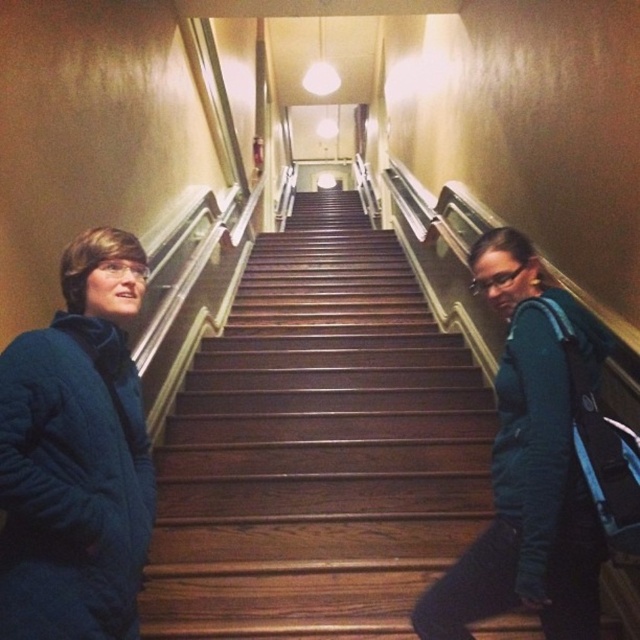
Question: Which point appears closest to the camera in this image?

Choices:
 (A) (339, 324)
 (B) (122, 474)
 (C) (532, 531)

Answer: (C)

Question: Which object is the farthest from the blue puffy jacket at left?

Choices:
 (A) brown wooden stairs at center
 (B) blue fleece jacket at left

Answer: (A)

Question: Based on their relative distances, which object is farther from the brown wooden stairs at center?

Choices:
 (A) blue fleece jacket at left
 (B) blue puffy jacket at left

Answer: (B)

Question: Does brown wooden stairs at center have a larger size compared to blue puffy jacket at left?

Choices:
 (A) no
 (B) yes

Answer: (A)

Question: In this image, where is brown wooden stairs at center located relative to blue fleece jacket at left?

Choices:
 (A) right
 (B) left

Answer: (B)

Question: Does blue puffy jacket at left appear under blue fleece jacket at left?

Choices:
 (A) no
 (B) yes

Answer: (A)